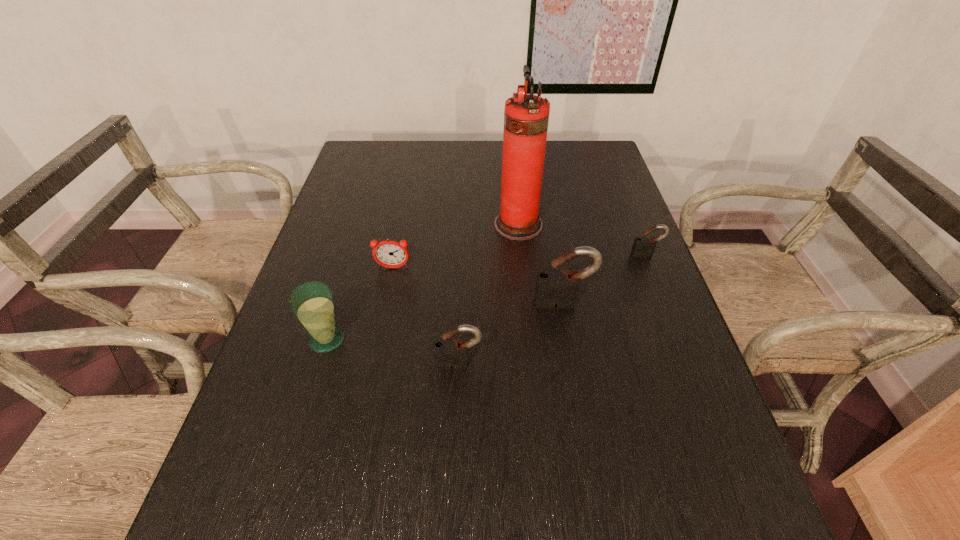
Locate an element on the screen. The width and height of the screenshot is (960, 540). the second shortest padlock is located at coordinates (449, 353).

Where is `the third object from left to right`? This screenshot has height=540, width=960. the third object from left to right is located at coordinates (449, 353).

I want to click on the second nearest padlock, so click(554, 286).

What are the coordinates of `the third nearest object` in the screenshot? It's located at (554, 286).

Identify the location of the rightmost padlock. (642, 245).

You are a GUI agent. You are given a task and a screenshot of the screen. Output one action in this format:
    pyautogui.click(x=<x>, y=<y>)
    Task: Click on the farthest padlock
    The image size is (960, 540).
    Given the screenshot: What is the action you would take?
    pyautogui.click(x=642, y=245)

Locate an element on the screen. fire extinguisher is located at coordinates (526, 116).

Locate an element on the screen. the tallest object is located at coordinates (526, 116).

Where is `the leftmost object`? the leftmost object is located at coordinates (312, 303).

The height and width of the screenshot is (540, 960). I want to click on glass, so click(x=312, y=303).